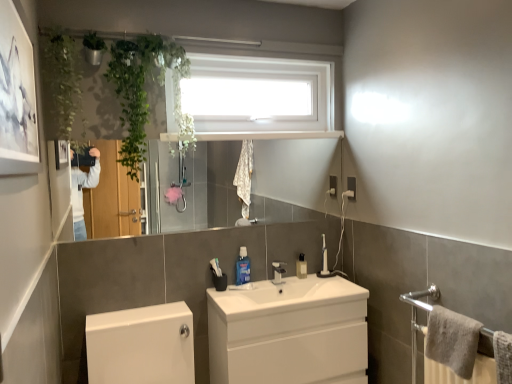
The image size is (512, 384). Find the location of `vacant area that is situated to the right of blue glossy mouthwash at center, the first toiletry viewed from the left`. vacant area that is situated to the right of blue glossy mouthwash at center, the first toiletry viewed from the left is located at coordinates (273, 279).